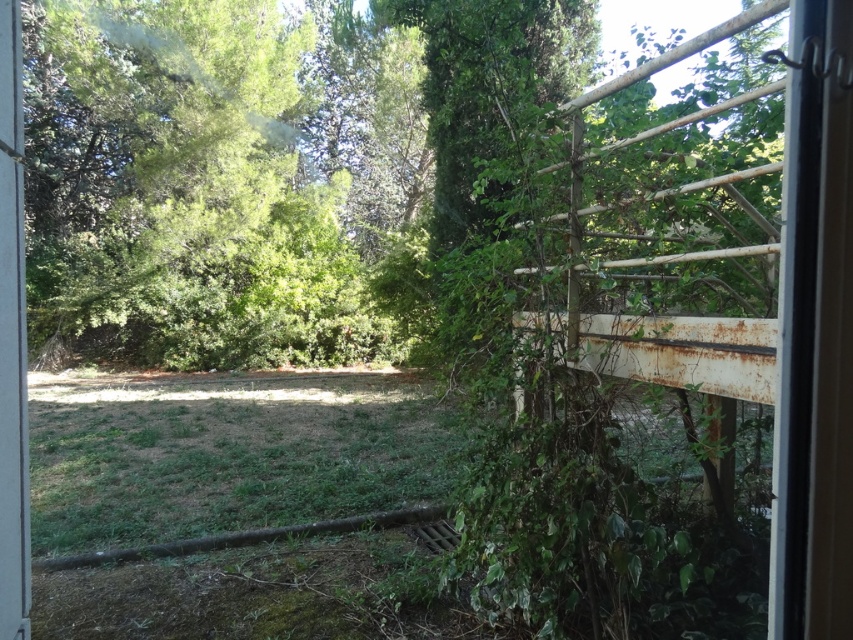
You are standing inside a building and want to exit through the clear glass screen door at right. Based on the coordinates provided, can you determine if the door is positioned near the ground level or higher up?

The clear glass screen door at right is located at coordinates point (816, 330), which places it near the ground level since the y coordinate 0.958 is closer to 1, indicating proximity to the bottom of the image.

Based on the photo, you are trying to exit through one of the doors. The clear glass screen door at right is positioned over the white plastic screen door at left. Which door is higher up?

The clear glass screen door at right is positioned over the white plastic screen door at left, so it is higher up.